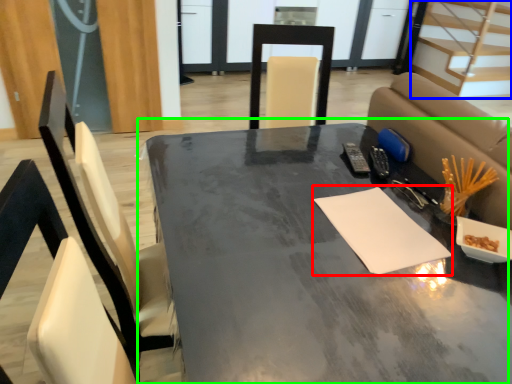
Question: Considering the real-world distances, which object is closest to notepad (highlighted by a red box)? stairwell (highlighted by a blue box) or table (highlighted by a green box).

Choices:
 (A) stairwell
 (B) table

Answer: (B)